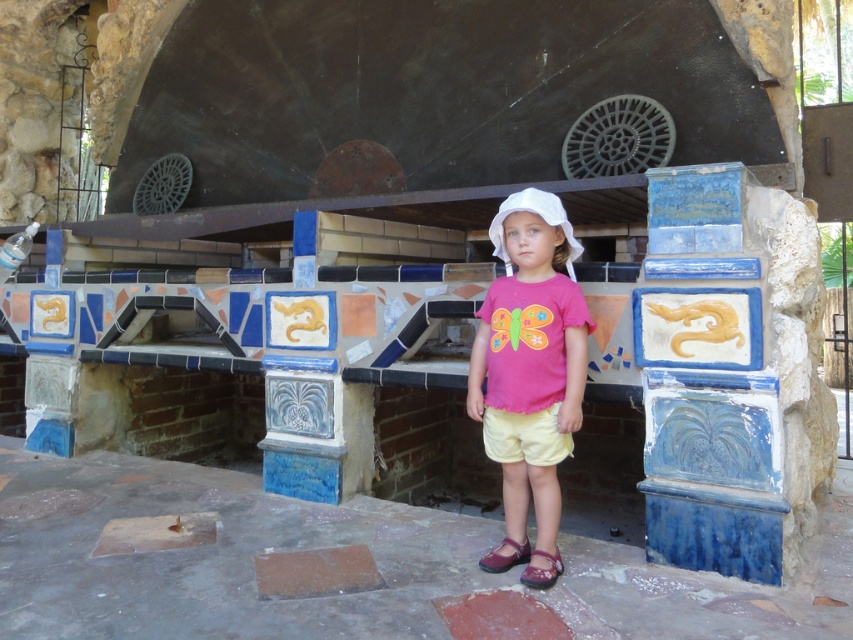
Does pink fabric shirt at center have a greater height compared to yellow cotton shorts at center?

Correct, pink fabric shirt at center is much taller as yellow cotton shorts at center.

Can you confirm if pink fabric shirt at center is bigger than yellow cotton shorts at center?

Indeed, pink fabric shirt at center has a larger size compared to yellow cotton shorts at center.

Is point (500, 429) positioned behind point (555, 413)?

Yes, it is.

Image resolution: width=853 pixels, height=640 pixels. I want to click on pink fabric shirt at center, so click(531, 372).